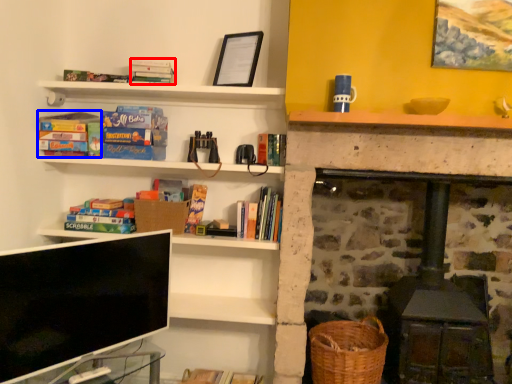
Question: Which of the following is the closest to the observer, book (highlighted by a red box) or book (highlighted by a blue box)?

Choices:
 (A) book
 (B) book

Answer: (A)